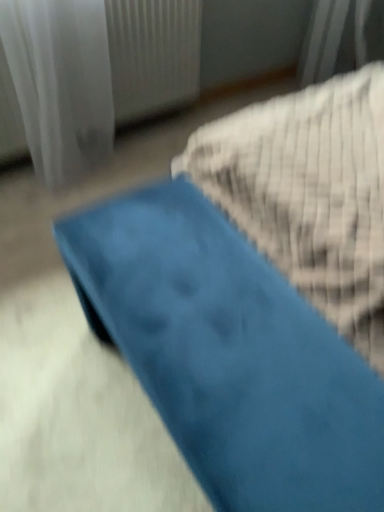
Where is `free space above blue fabric ottoman at center (from a real-world perspective)`? free space above blue fabric ottoman at center (from a real-world perspective) is located at coordinates (221, 309).